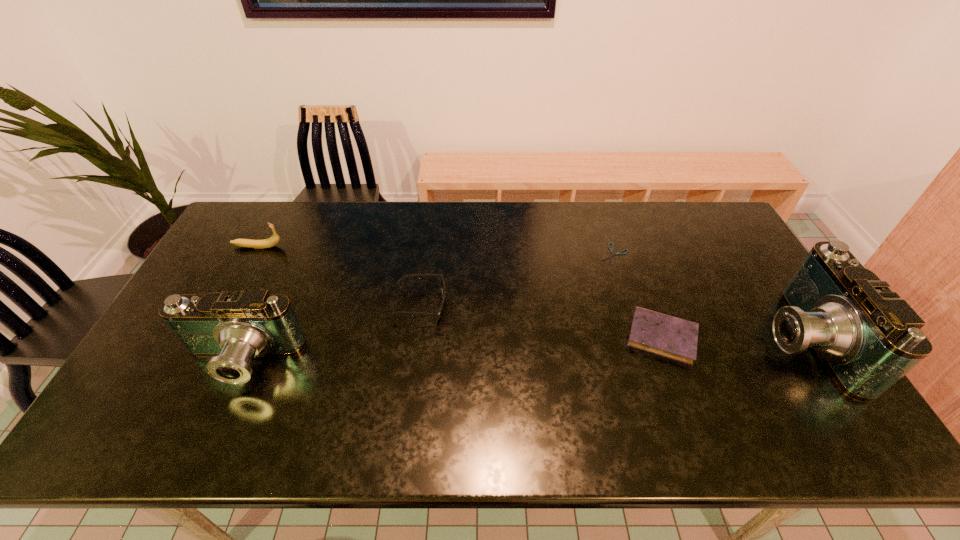
You are a GUI agent. You are given a task and a screenshot of the screen. Output one action in this format:
    pyautogui.click(x=<x>, y=<y>)
    Task: Click on the left camcorder
    
    Given the screenshot: What is the action you would take?
    pyautogui.click(x=233, y=328)

The height and width of the screenshot is (540, 960). Identify the location of the second tallest object. (233, 328).

Where is `the taller camcorder`? This screenshot has width=960, height=540. the taller camcorder is located at coordinates pos(868,338).

Identify the location of the tallest object. This screenshot has width=960, height=540. (868, 338).

Where is `banana`? The height and width of the screenshot is (540, 960). banana is located at coordinates (274, 239).

I want to click on shears, so click(619, 253).

I want to click on sunglasses, so click(x=442, y=284).

You are a GUI agent. You are given a task and a screenshot of the screen. Output one action in this format:
    pyautogui.click(x=<x>, y=<y>)
    Task: Click on the fourth object from right to left
    The image size is (960, 540).
    Given the screenshot: What is the action you would take?
    [x=442, y=284]

At what (x,y) coordinates should I click in order to perform the action: click on diary. Please return your answer as a coordinate pair (x, y). Looking at the image, I should click on (657, 333).

Find the location of a particular element. The width and height of the screenshot is (960, 540). vacant position located 0.380m on the front-facing side of the taller camcorder is located at coordinates (621, 340).